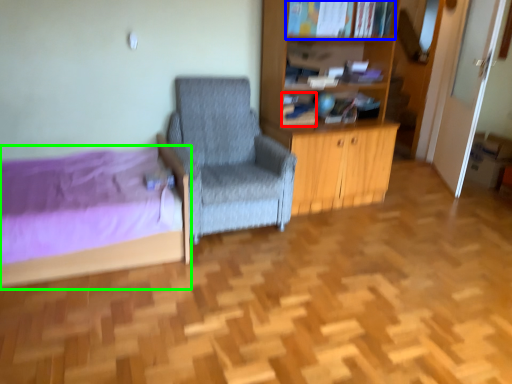
Question: Estimate the real-world distances between objects in this image. Which object is closer to book (highlighted by a red box), book (highlighted by a blue box) or bed (highlighted by a green box)?

Choices:
 (A) book
 (B) bed

Answer: (A)